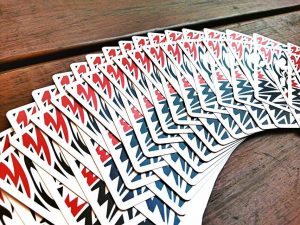
Where is `wooden table top`? This screenshot has height=225, width=300. wooden table top is located at coordinates (63, 18).